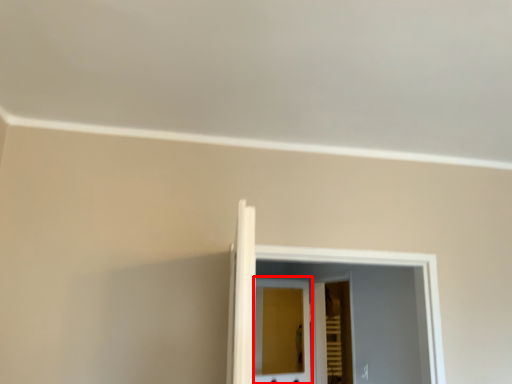
Question: From the image's perspective, what is the correct spatial relationship of screen door (annotated by the red box) in relation to screen door?

Choices:
 (A) below
 (B) above

Answer: (A)